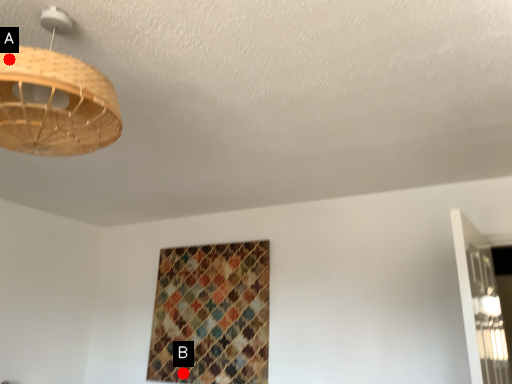
Question: Two points are circled on the image, labeled by A and B beside each circle. Which of the following is the closest to the observer?

Choices:
 (A) A is closer
 (B) B is closer

Answer: (A)